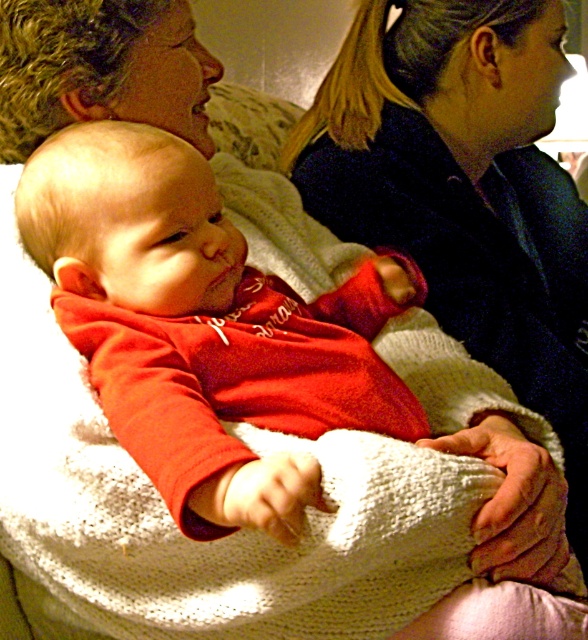
Where is the matte red sweater at center located in the image?

The matte red sweater at center is located at point (x=205, y=328) in the image.

You are a photographer setting up for a family photo. You notice the matte red sweater at center and the matte black sweater at upper right. Which sweater should you adjust to ensure both are equally visible in the frame?

You should adjust the matte red sweater at center because it has a smaller width than the matte black sweater at upper right, so expanding its size or positioning it more prominently can balance their visibility.